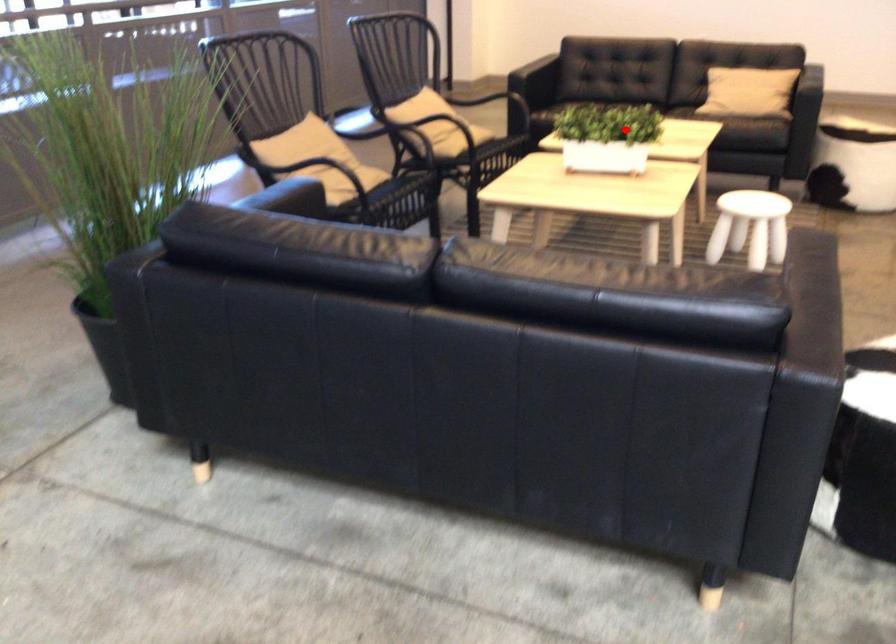
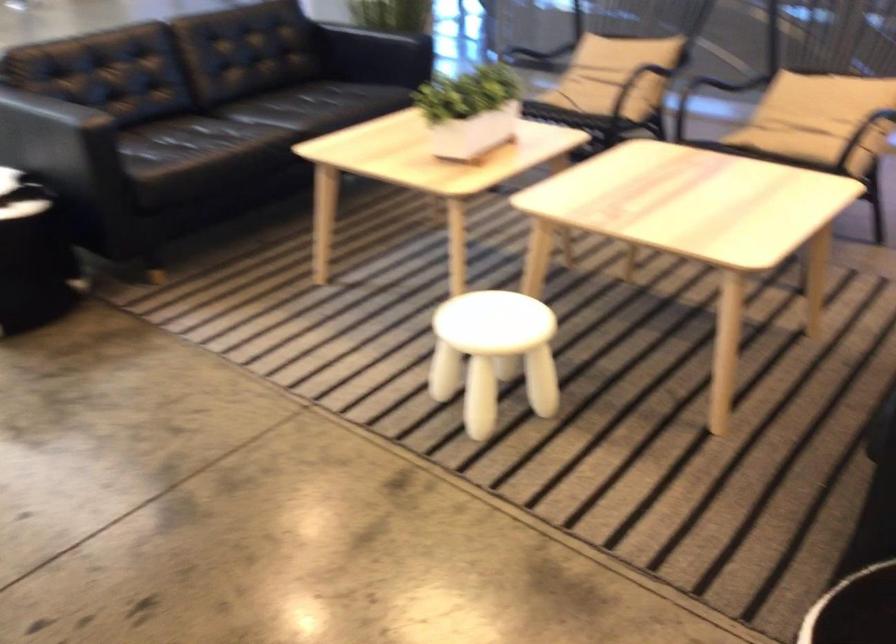
Find the pixel in the second image that matches the highlighted location in the first image.

(470, 111)